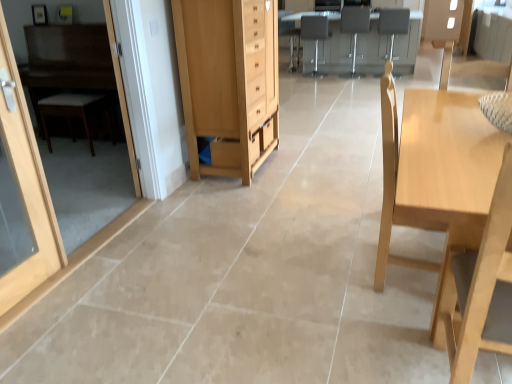
At what (x,y) coordinates should I click in order to perform the action: click on light wood cabinet at center. Please return your answer as a coordinate pair (x, y). This screenshot has width=512, height=384. Looking at the image, I should click on (228, 80).

What is the approximate width of transparent glass door at left, positioned as the first screen door in front-to-back order?

19.58 centimeters.

This screenshot has width=512, height=384. What do you see at coordinates (314, 36) in the screenshot?
I see `matte gray armchair at center, the 3th armchair in the right-to-left sequence` at bounding box center [314, 36].

At what (x,y) coordinates should I click in order to perform the action: click on light wood cabinet at center. Please return your answer as a coordinate pair (x, y). Looking at the image, I should click on (228, 80).

Which is correct: matte gray table at center, the 1th table in the top-to-bottom sequence, is inside white glossy screen door at left, marked as the 1th screen door in a back-to-front arrangement, or outside of it?

matte gray table at center, the 1th table in the top-to-bottom sequence, cannot be found inside white glossy screen door at left, marked as the 1th screen door in a back-to-front arrangement.

Considering the sizes of matte gray table at center, the 2th table from the front, and white glossy screen door at left, marked as the 1th screen door in a back-to-front arrangement, in the image, is matte gray table at center, the 2th table from the front, bigger or smaller than white glossy screen door at left, marked as the 1th screen door in a back-to-front arrangement,?

In the image, matte gray table at center, the 2th table from the front, appears to be larger than white glossy screen door at left, marked as the 1th screen door in a back-to-front arrangement.

Looking at this image, relative to white glossy screen door at left, the 2th screen door positioned from the front, is matte gray table at center, the 1th table positioned from the back, in front or behind?

matte gray table at center, the 1th table positioned from the back, is positioned farther from the viewer than white glossy screen door at left, the 2th screen door positioned from the front.

From the image's perspective, is matte gray table at center, the 1th table in the top-to-bottom sequence, located above white glossy screen door at left, marked as the 1th screen door in a back-to-front arrangement?

Correct, matte gray table at center, the 1th table in the top-to-bottom sequence, appears higher than white glossy screen door at left, marked as the 1th screen door in a back-to-front arrangement, in the image.

Relative to light wood chair at right, is wooden drawer at center in front or behind?

Visually, wooden drawer at center is located behind light wood chair at right.

Which is nearer, (264, 124) or (456, 374)?

The point (456, 374) is in front.

The image size is (512, 384). I want to click on drawer on the left of light wood chair at right, so click(266, 134).

Considering the sizes of wooden drawer at center and light wood chair at right in the image, is wooden drawer at center bigger or smaller than light wood chair at right?

Considering their sizes, wooden drawer at center takes up less space than light wood chair at right.

Is wooden drawer at center taller than light wood cabinet at center?

No.

Is wooden drawer at center beside light wood cabinet at center?

wooden drawer at center and light wood cabinet at center are not in contact.

What's the angular difference between wooden drawer at center and light wood cabinet at center's facing directions?

They differ by 0.000334 degrees in their facing directions.

The width and height of the screenshot is (512, 384). What are the coordinates of `cabinetry on the left of the wooden drawer at center` in the screenshot? It's located at (228, 80).

Does point (64, 110) come in front of point (21, 286)?

No, (64, 110) is behind (21, 286).

This screenshot has width=512, height=384. I want to click on door that appears on the right of white woven stool at left, so click(x=26, y=187).

Which object is positioned more to the right, white woven stool at left or wooden door at left?

wooden door at left.

Is white woven stool at left spatially inside wooden door at left, or outside of it?

white woven stool at left is spatially situated outside wooden door at left.

Are white glossy screen door at left, marked as the 1th screen door in a back-to-front arrangement, and white woven stool at left far apart?

Yes.

Is white glossy screen door at left, marked as the 1th screen door in a back-to-front arrangement, wider than white woven stool at left?

No.

In the scene shown: Which of these two, white glossy screen door at left, the 2th screen door positioned from the front, or white woven stool at left, is bigger?

With larger size is white glossy screen door at left, the 2th screen door positioned from the front.

Which of these two, white woven stool at left or light wood cabinet at center, stands taller?

light wood cabinet at center is taller.

Which object is more forward, white woven stool at left or light wood cabinet at center?

light wood cabinet at center is in front.

From the image's perspective, is white woven stool at left located above or below light wood cabinet at center?

From the image's perspective, white woven stool at left appears below light wood cabinet at center.

Is light wood cabinet at center taller than light wood table at right, which ranks as the first table in front-to-back order?

Yes, light wood cabinet at center is taller than light wood table at right, which ranks as the first table in front-to-back order.

Is light wood cabinet at center positioned far away from light wood table at right, which ranks as the first table in front-to-back order?

Yes, light wood cabinet at center and light wood table at right, which ranks as the first table in front-to-back order, are located far from each other.

Is light wood cabinet at center facing towards light wood table at right, which ranks as the first table in bottom-to-top order?

No, light wood cabinet at center is not facing towards light wood table at right, which ranks as the first table in bottom-to-top order.

Is light wood cabinet at center located outside light wood table at right, which ranks as the first table in front-to-back order?

Absolutely, light wood cabinet at center is external to light wood table at right, which ranks as the first table in front-to-back order.

I want to click on the 1st screen door located above the matte gray table at center, acting as the second table starting from the bottom (from a real-world perspective), so click(123, 102).

The image size is (512, 384). I want to click on chair in front of the wooden drawer at center, so click(483, 286).

Based on their spatial positions, is wooden door at left or light wood chair at right closer to matte gray armchair at upper center, positioned as the third armchair in left-to-right order?

wooden door at left is closer to matte gray armchair at upper center, positioned as the third armchair in left-to-right order.

From the image, which object appears to be farther from light wood table at right, acting as the second table starting from the back, matte gray armchair at center, the 2th armchair viewed from the left, or matte gray table at center, acting as the second table starting from the bottom?

Based on the image, matte gray armchair at center, the 2th armchair viewed from the left, appears to be further to light wood table at right, acting as the second table starting from the back.

Looking at the image, which one is located closer to transparent glass door at left, which is the 2th screen door in back-to-front order, light wood cabinet at center or matte gray armchair at center, the 2th armchair viewed from the left?

light wood cabinet at center is positioned closer to the anchor transparent glass door at left, which is the 2th screen door in back-to-front order.

Considering their positions, is wooden drawer at center positioned further to matte gray table at center, the 1th table positioned from the back, than matte gray armchair at center, the 2th armchair viewed from the right?

Based on the image, wooden drawer at center appears to be further to matte gray table at center, the 1th table positioned from the back.

Which object lies further to the anchor point light wood cabinet at center, wooden drawer at center or white woven stool at left?

Among the two, white woven stool at left is located further to light wood cabinet at center.

Looking at the image, which one is located closer to light wood cabinet at center, transparent glass door at left, positioned as the first screen door in front-to-back order, or wooden drawer at center?

The object closer to light wood cabinet at center is wooden drawer at center.

Estimate the real-world distances between objects in this image. Which object is closer to matte gray armchair at center, the 2th armchair viewed from the right, matte gray armchair at center, which ranks as the first armchair in left-to-right order, or light wood table at right, which ranks as the first table in front-to-back order?

The object closer to matte gray armchair at center, the 2th armchair viewed from the right, is matte gray armchair at center, which ranks as the first armchair in left-to-right order.

From the image, which object appears to be farther from transparent glass door at left, which is the 2th screen door in back-to-front order, light wood chair at right or wooden drawer at center?

light wood chair at right.

Find the location of a particular element. The image size is (512, 384). table between light wood chair at right and light wood cabinet at center in the front-back direction is located at coordinates 437,182.

This screenshot has width=512, height=384. In order to click on screen door between transparent glass door at left, positioned as the first screen door in front-to-back order, and white woven stool at left, along the z-axis in this screenshot , I will do `click(123, 102)`.

Identify the location of cabinetry positioned between light wood chair at right and matte gray armchair at upper center, positioned as the third armchair in left-to-right order, from near to far. (228, 80).

The height and width of the screenshot is (384, 512). What are the coordinates of `table between light wood chair at right and white woven stool at left along the z-axis` in the screenshot? It's located at (437, 182).